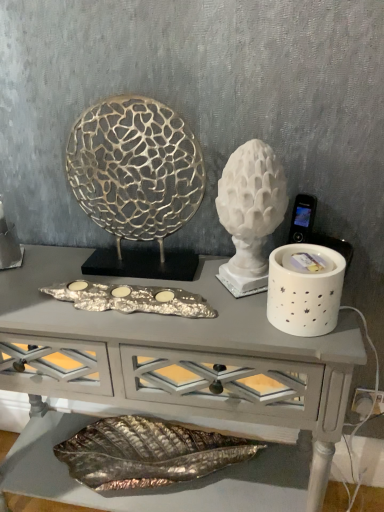
The width and height of the screenshot is (384, 512). I want to click on vacant area on top of silver metallic tray at center (from a real-world perspective), so click(x=124, y=290).